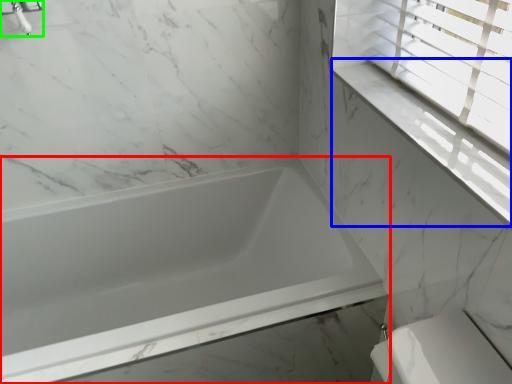
Question: Considering the real-world distances, which object is closest to bathtub (highlighted by a red box)? window sill (highlighted by a blue box) or faucet (highlighted by a green box).

Choices:
 (A) window sill
 (B) faucet

Answer: (A)